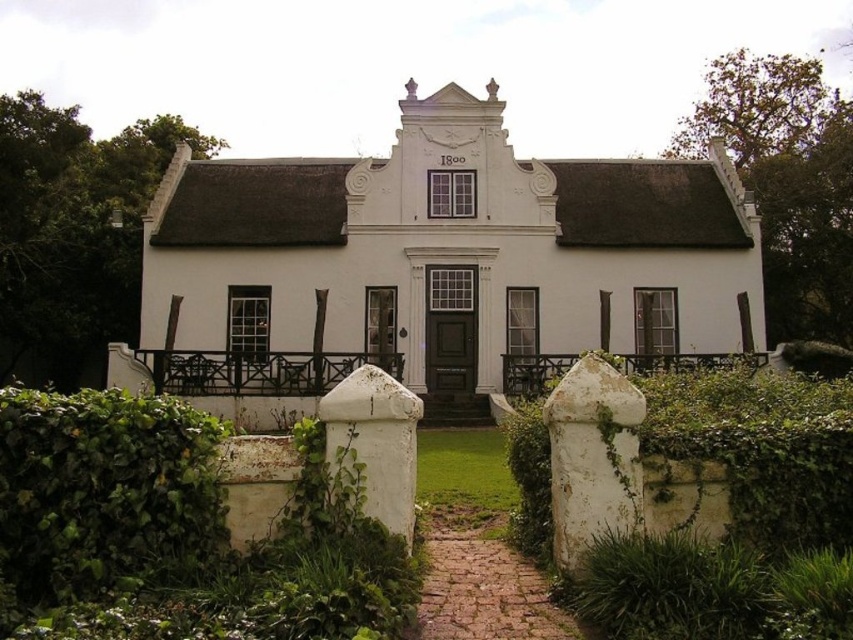
Question: Is green leafy hedge at lower left bigger than wooden/rustic fence at center?

Choices:
 (A) no
 (B) yes

Answer: (B)

Question: Which of the following is the closest to the observer?

Choices:
 (A) (457, 518)
 (B) (817, 477)
 (C) (653, 440)
 (D) (224, 381)

Answer: (B)

Question: Which point is closer to the camera?

Choices:
 (A) (283, 385)
 (B) (190, 513)
 (C) (553, 355)
 (D) (453, 548)

Answer: (B)

Question: Which is farther from the green leafy hedge at lower left?

Choices:
 (A) wooden/rustic fence at center
 (B) white wooden fence at center
 (C) green ivy-covered stone gate at center

Answer: (A)

Question: Is green leafy hedge at lower left to the right of green ivy-covered stone at center from the viewer's perspective?

Choices:
 (A) no
 (B) yes

Answer: (A)

Question: Does green leafy hedge at lower left come in front of green ivy-covered stone at center?

Choices:
 (A) yes
 (B) no

Answer: (A)